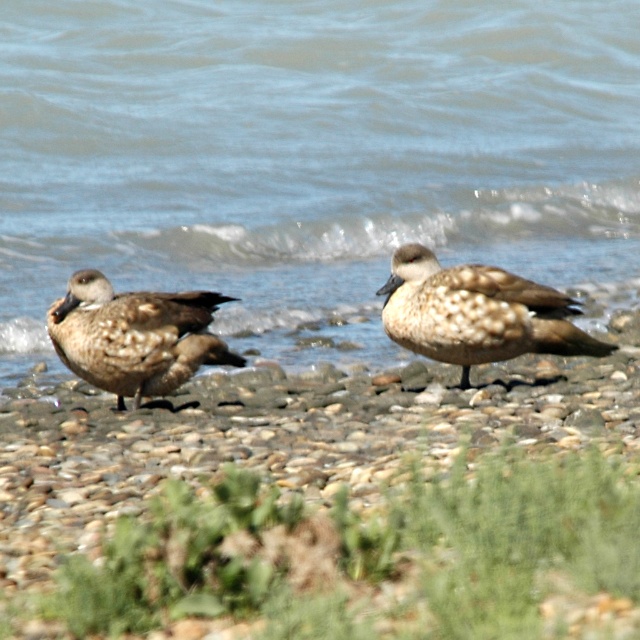
You are a birdwatcher observing the two ducks. Which duck is closer to you, the speckled feathered duck at center or the brown speckled duck at left?

The speckled feathered duck at center is closer to you because the brown speckled duck at left is behind it.

You are a photographer standing on the shore and want to take a photo of both the blue water at center and the brown speckled duck at left. Which object will appear closer to the camera in the photo?

The brown speckled duck at left will appear closer to the camera because it is closer to the viewer than the blue water at center, which is further away.

In the scene shown: You are standing on the shore and want to walk towards the blue water at center. Which direction should you move relative to the speckled stone pebbles at center?

To reach the blue water at center, you should move to the left side of the speckled stone pebbles at center since the blue water at center is positioned on the left side of them.